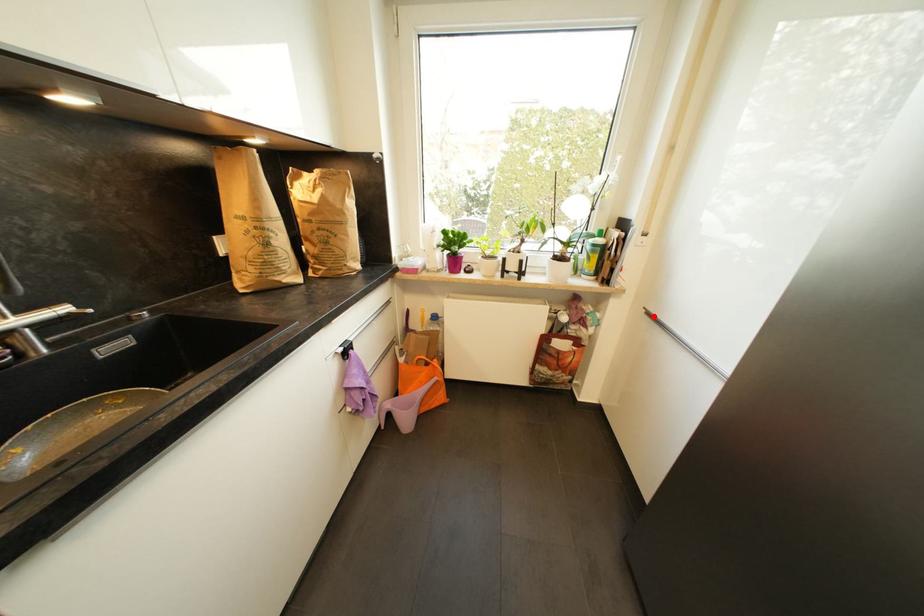
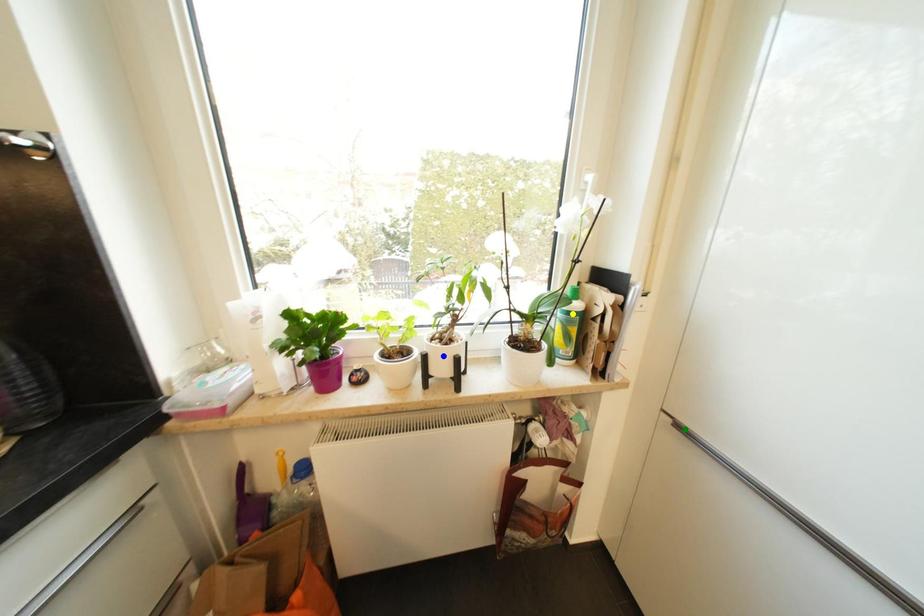
Question: I am providing you with two images of the same scene from different viewpoints. A red point is marked on the first image. You are given multiple points on the second image. Which mark in image 2 goes with the point in image 1?

Choices:
 (A) yellow point
 (B) green point
 (C) blue point

Answer: (B)